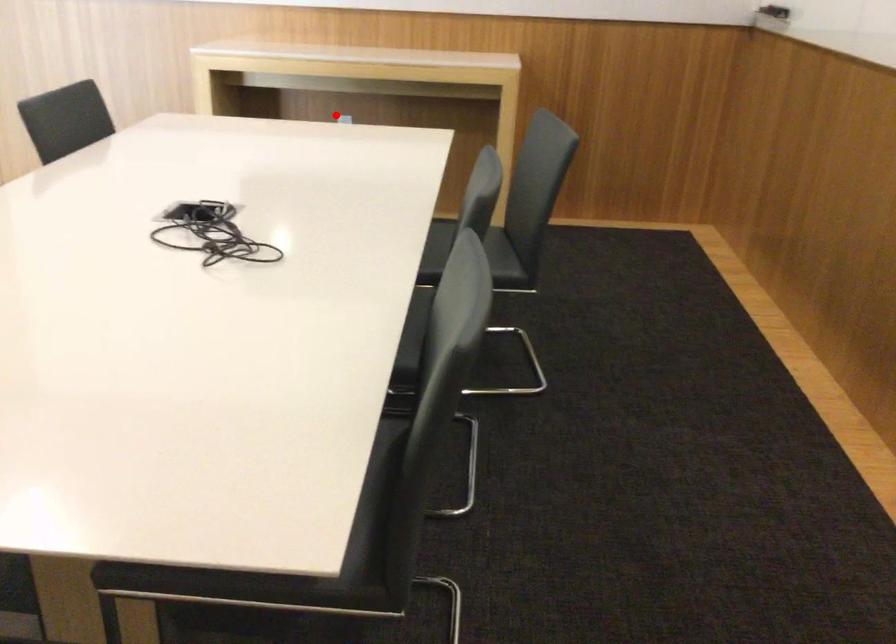
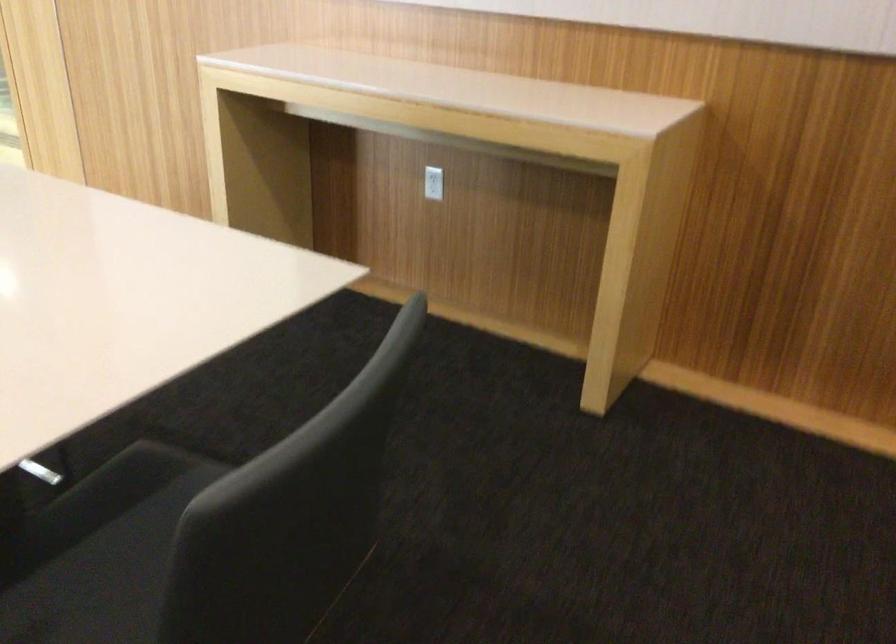
Where in the second image is the point corresponding to the highlighted location from the first image?

(433, 183)